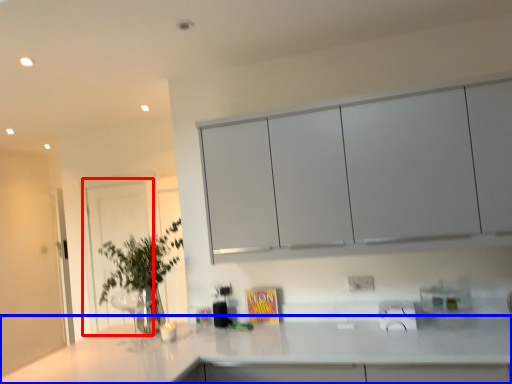
Question: Which object is further to the camera taking this photo, glass door (highlighted by a red box) or countertop (highlighted by a blue box)?

Choices:
 (A) glass door
 (B) countertop

Answer: (A)